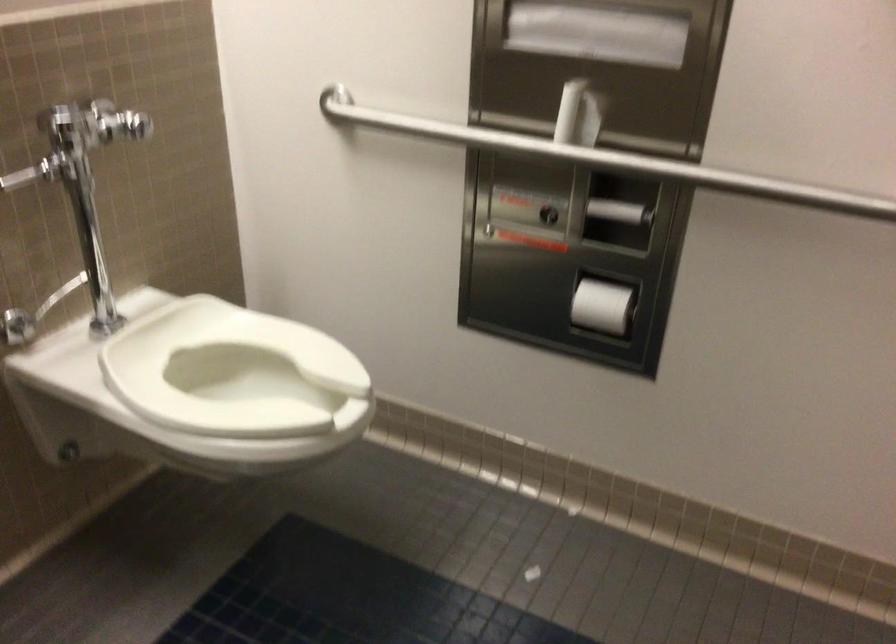
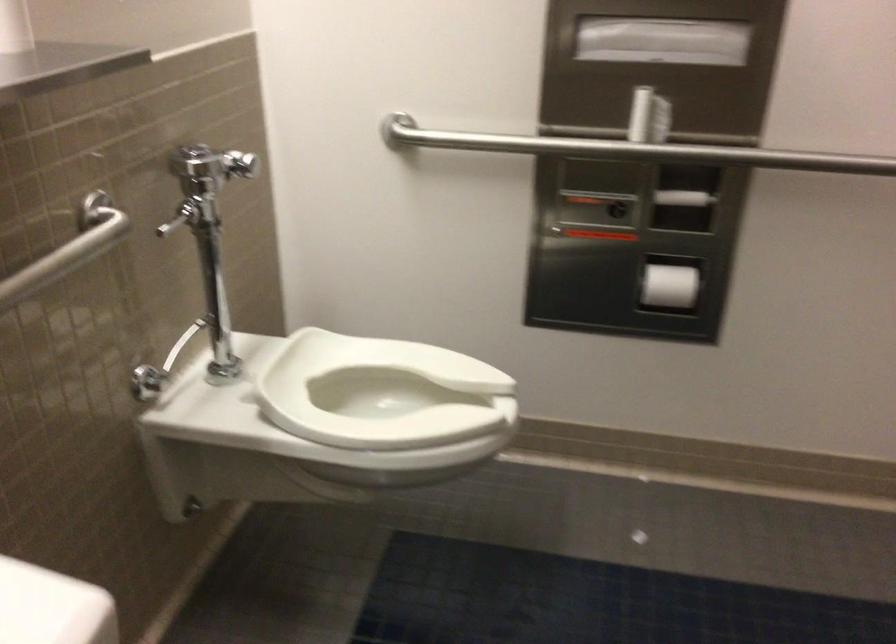
In the second image, find the point that corresponds to (547,149) in the first image.

(630, 149)